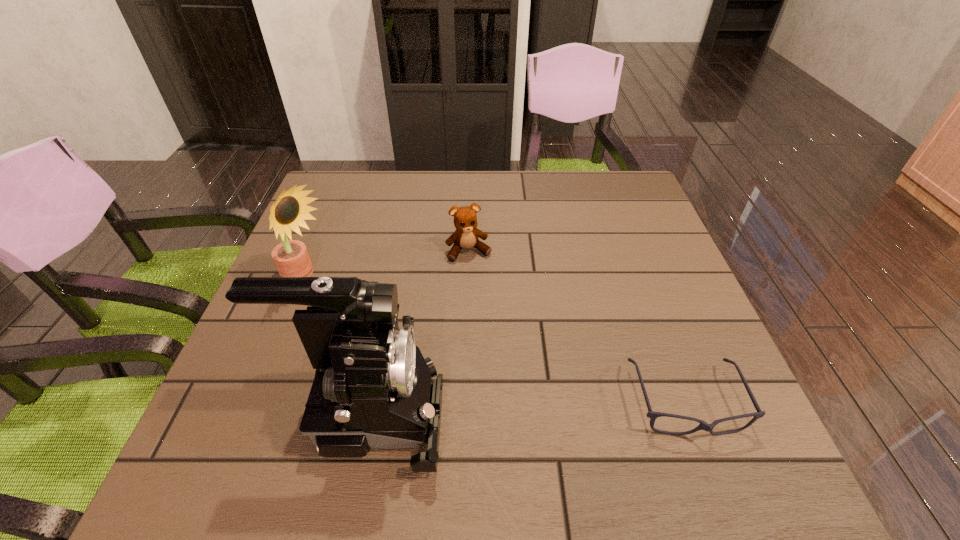
Where is `vacant space located 0.260m on the front-facing side of the second shortest object`? This screenshot has width=960, height=540. vacant space located 0.260m on the front-facing side of the second shortest object is located at coordinates (504, 346).

Where is `vacant region located on the front-facing side of the second shortest object`? The image size is (960, 540). vacant region located on the front-facing side of the second shortest object is located at coordinates (523, 397).

At what (x,y) coordinates should I click in order to perform the action: click on free space located 0.210m on the front-facing side of the second shortest object. Please return your answer as a coordinate pair (x, y). Looking at the image, I should click on (497, 328).

Image resolution: width=960 pixels, height=540 pixels. Find the location of `camcorder present at the near edge`. camcorder present at the near edge is located at coordinates (372, 388).

This screenshot has height=540, width=960. I want to click on spectacles that is at the near edge, so click(652, 415).

The image size is (960, 540). Find the location of `camcorder present at the left edge`. camcorder present at the left edge is located at coordinates (372, 388).

Find the location of `sunflower located in the left edge section of the desktop`. sunflower located in the left edge section of the desktop is located at coordinates (291, 257).

Where is `object that is at the right edge`? The height and width of the screenshot is (540, 960). object that is at the right edge is located at coordinates (652, 415).

Identify the location of object located in the near left corner section of the desktop. (372, 388).

This screenshot has width=960, height=540. Identify the location of object that is at the near right corner. (652, 415).